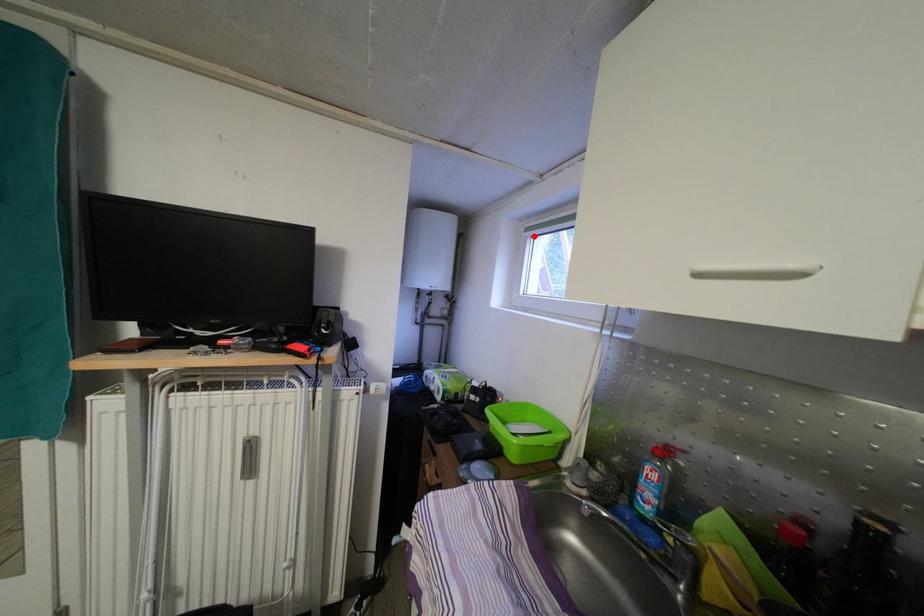
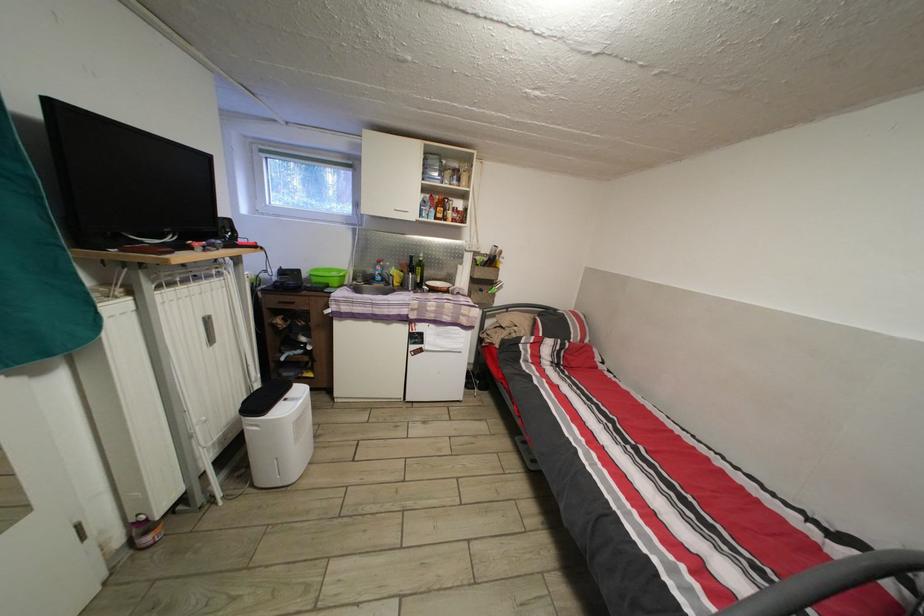
Question: A red point is marked in image1. In image2, is the corresponding 3D point closer to the camera or farther? Reply with the corresponding letter.

Choices:
 (A) The corresponding 3D point is closer.
 (B) The corresponding 3D point is farther.

Answer: (B)